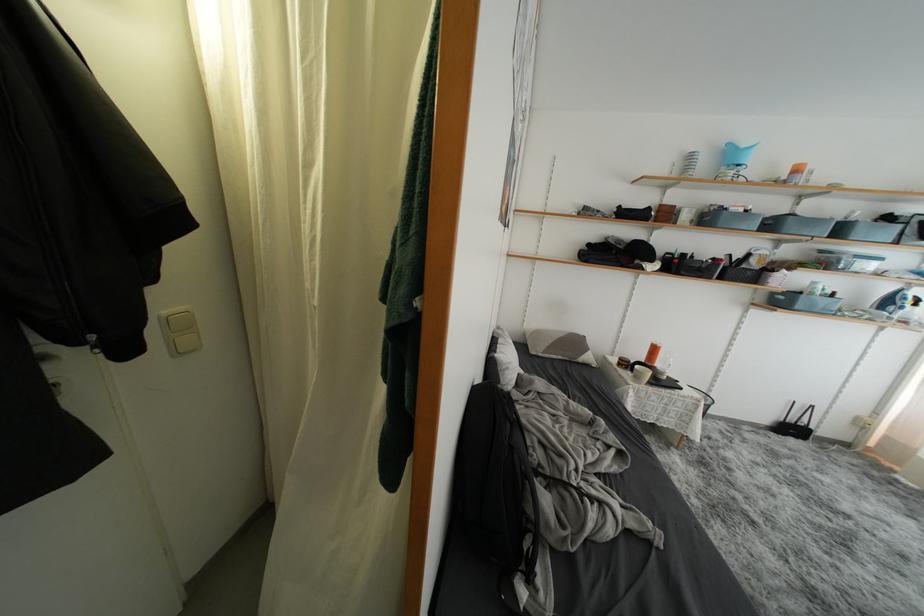
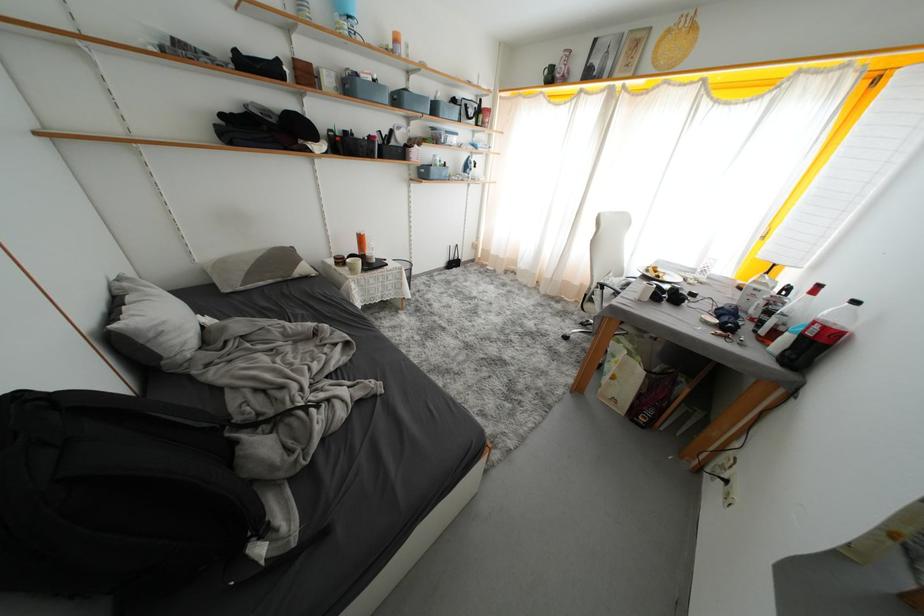
Where in the second image is the point corresponding to the point at 787,305 from the first image?

(431, 177)